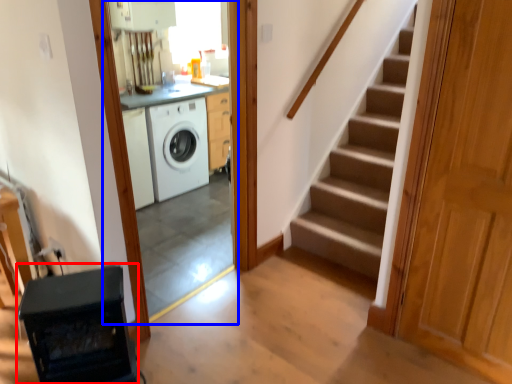
Question: Which point is further to the camera, appliance (highlighted by a red box) or screen door (highlighted by a blue box)?

Choices:
 (A) appliance
 (B) screen door

Answer: (B)